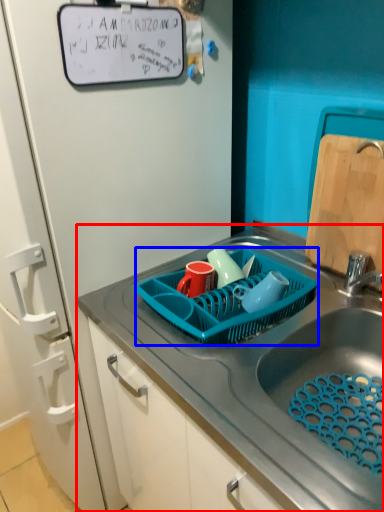
Question: Which of the following is the closest to the observer, sink (highlighted by a red box) or basket (highlighted by a blue box)?

Choices:
 (A) sink
 (B) basket

Answer: (A)